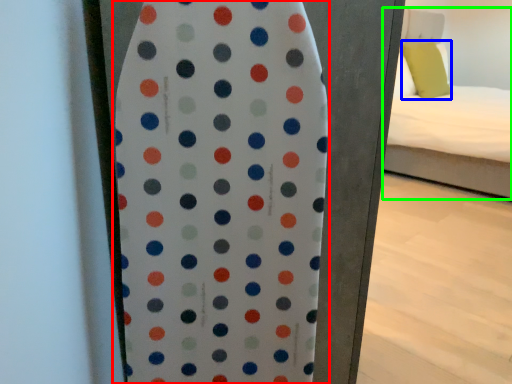
Question: Estimate the real-world distances between objects in this image. Which object is farther from surfboard (highlighted by a red box), pillow (highlighted by a blue box) or bed (highlighted by a green box)?

Choices:
 (A) pillow
 (B) bed

Answer: (A)